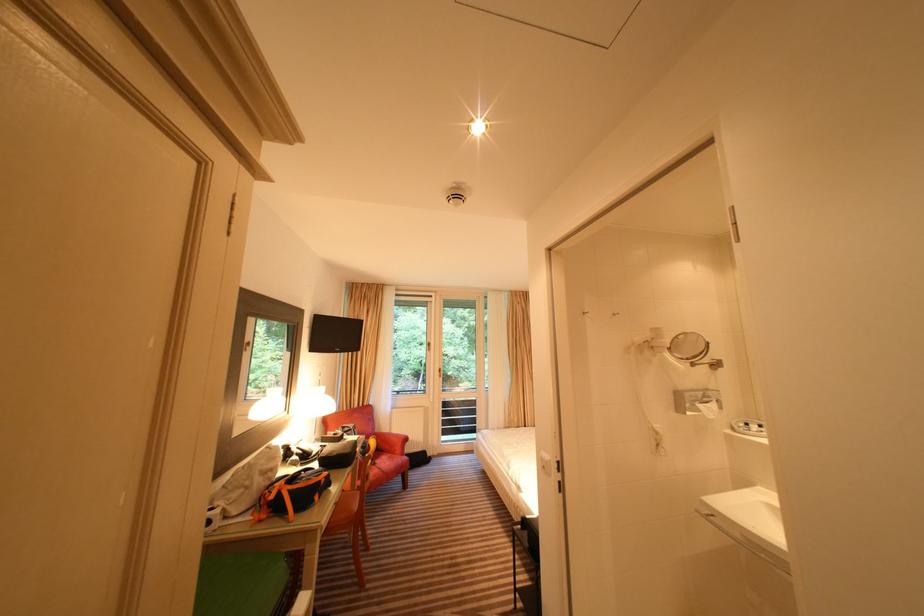
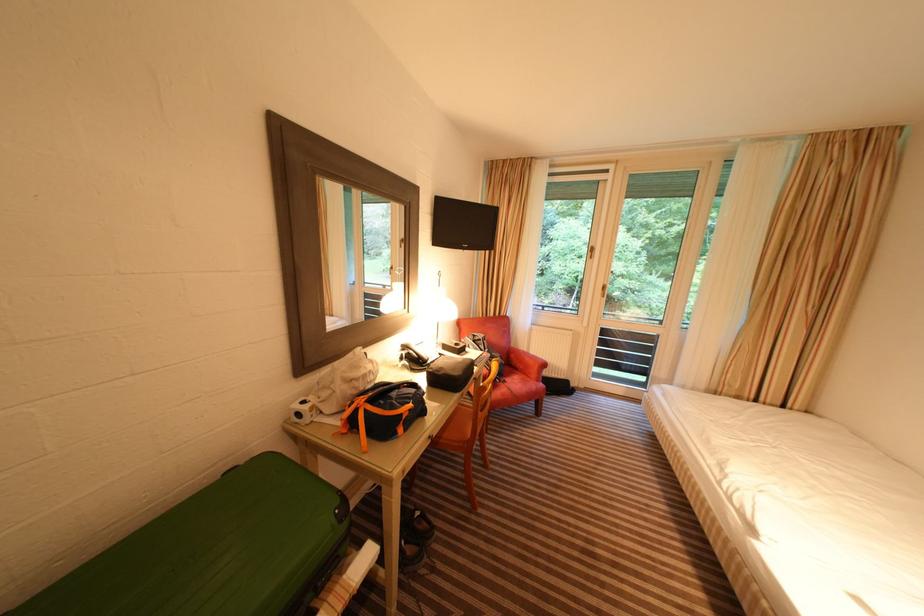
The point at (339,454) is marked in the first image. Where is the corresponding point in the second image?

(447, 371)